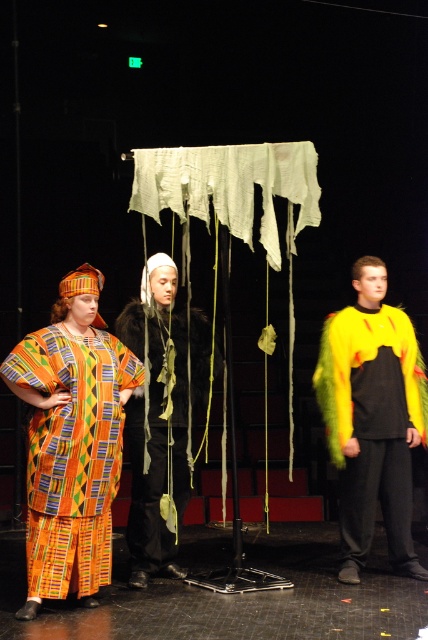
Image resolution: width=428 pixels, height=640 pixels. I want to click on multicolored woven fabric dress at left, so click(x=71, y=452).

From the picture: Can you confirm if multicolored woven fabric dress at left is positioned to the left of fluorescent yellow fur vest at right?

Indeed, multicolored woven fabric dress at left is positioned on the left side of fluorescent yellow fur vest at right.

Where is `multicolored woven fabric dress at left`? The image size is (428, 640). multicolored woven fabric dress at left is located at coordinates (71, 452).

Does multicolored woven fabric dress at left have a lesser width compared to velvet black cape at center?

In fact, multicolored woven fabric dress at left might be wider than velvet black cape at center.

Image resolution: width=428 pixels, height=640 pixels. What do you see at coordinates (71, 452) in the screenshot?
I see `multicolored woven fabric dress at left` at bounding box center [71, 452].

The height and width of the screenshot is (640, 428). In order to click on multicolored woven fabric dress at left in this screenshot , I will do `click(71, 452)`.

Does fluorescent yellow fur vest at right appear under velvet black cape at center?

Incorrect, fluorescent yellow fur vest at right is not positioned below velvet black cape at center.

Is fluorescent yellow fur vest at right thinner than velvet black cape at center?

No.

Which is in front, point (315, 387) or point (134, 522)?

Point (134, 522) is more forward.

Find the location of a particular element. The width and height of the screenshot is (428, 640). fluorescent yellow fur vest at right is located at coordinates (371, 422).